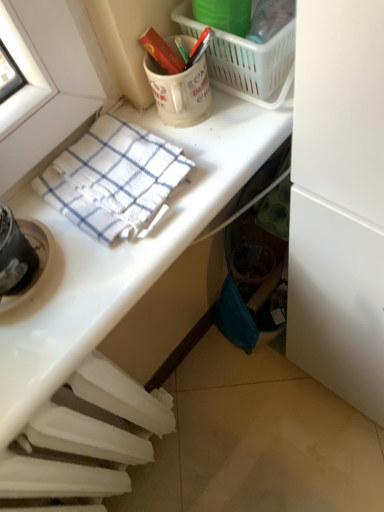
Where is `free space underneath white checkered towel at upper left (from a real-world perspective)`? free space underneath white checkered towel at upper left (from a real-world perspective) is located at coordinates (120, 185).